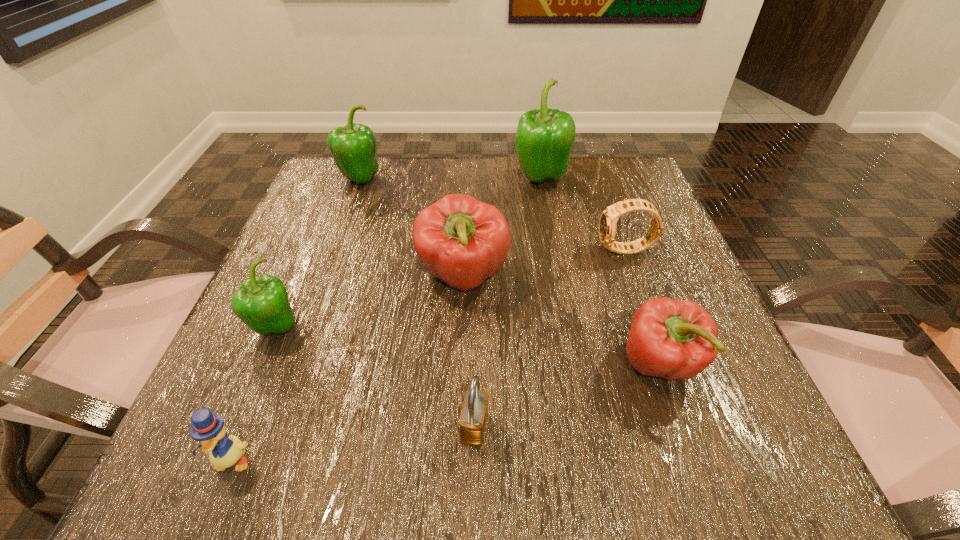
Where is `padlock positioned at the near edge`? The image size is (960, 540). padlock positioned at the near edge is located at coordinates (472, 423).

I want to click on duckling at the near edge, so click(208, 429).

Where is `duckling present at the left edge`? Image resolution: width=960 pixels, height=540 pixels. duckling present at the left edge is located at coordinates (208, 429).

The image size is (960, 540). What are the coordinates of `bell pepper that is at the right edge` in the screenshot? It's located at (672, 339).

Locate an element on the screen. watch at the right edge is located at coordinates (608, 221).

You are a GUI agent. You are given a task and a screenshot of the screen. Output one action in this format:
    pyautogui.click(x=<x>, y=<y>)
    Task: Click on the object that is at the far left corner
    
    Given the screenshot: What is the action you would take?
    pyautogui.click(x=353, y=147)

Locate an element on the screen. The width and height of the screenshot is (960, 540). object that is at the near left corner is located at coordinates (208, 429).

The width and height of the screenshot is (960, 540). I want to click on free space at the far edge, so click(x=485, y=169).

At what (x,y) coordinates should I click in order to perform the action: click on vacant space at the left edge of the desktop. Please return your answer as a coordinate pair (x, y). Image resolution: width=960 pixels, height=540 pixels. Looking at the image, I should click on (293, 227).

This screenshot has width=960, height=540. What are the coordinates of `free location at the right edge of the desktop` in the screenshot? It's located at (664, 237).